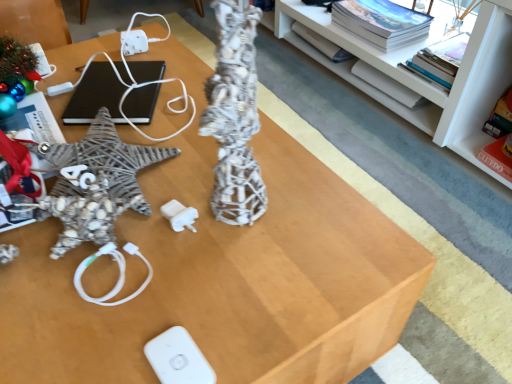
You are a GUI agent. You are given a task and a screenshot of the screen. Output one action in this format:
    pyautogui.click(x=<x>, y=<y>)
    Task: Click on the vacant region to the left of white matte wii controller at lower center
    
    Given the screenshot: What is the action you would take?
    pyautogui.click(x=77, y=326)